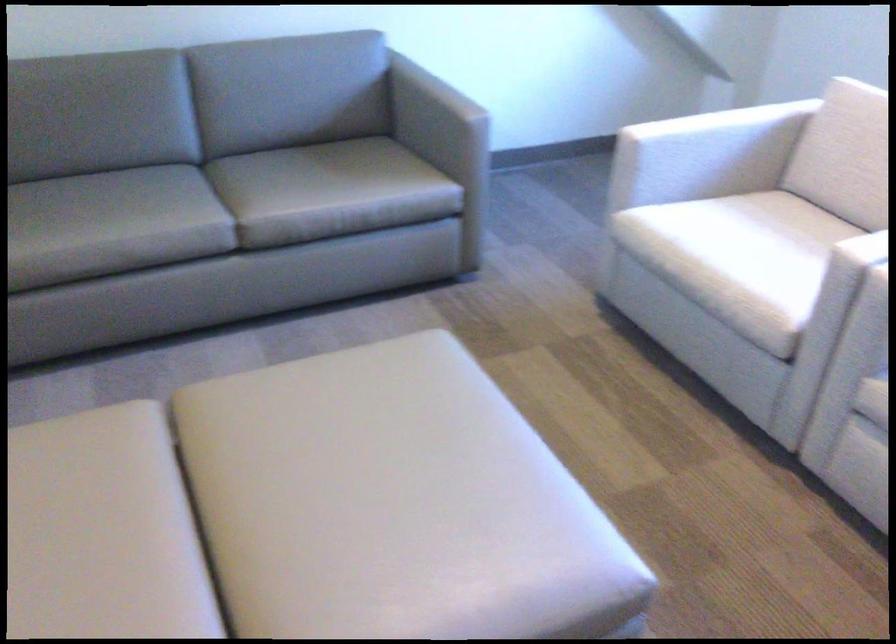
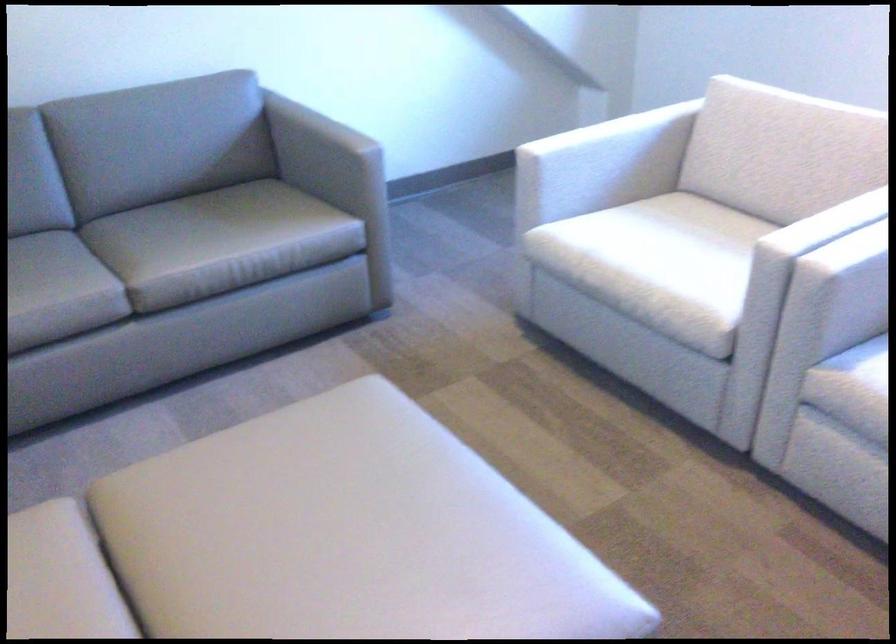
Question: The first image is from the beginning of the video and the second image is from the end. How did the camera likely rotate when shooting the video?

Choices:
 (A) Left
 (B) Right
 (C) Up
 (D) Down

Answer: (B)